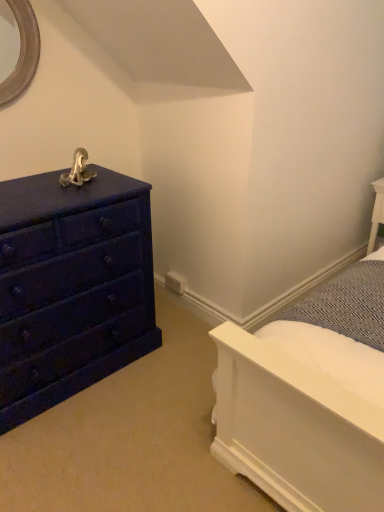
Question: Is white textured fabric at upper right turned away from matte dark blue dresser at left?

Choices:
 (A) no
 (B) yes

Answer: (A)

Question: From a real-world perspective, is white textured fabric at upper right located higher than matte dark blue dresser at left?

Choices:
 (A) no
 (B) yes

Answer: (A)

Question: Could you tell me if white textured fabric at upper right is facing matte dark blue dresser at left?

Choices:
 (A) no
 (B) yes

Answer: (A)

Question: Is white textured fabric at upper right outside matte dark blue dresser at left?

Choices:
 (A) yes
 (B) no

Answer: (A)

Question: From the image's perspective, does white textured fabric at upper right appear higher than matte dark blue dresser at left?

Choices:
 (A) yes
 (B) no

Answer: (B)

Question: Is white textured fabric at upper right positioned in front of matte dark blue dresser at left?

Choices:
 (A) yes
 (B) no

Answer: (B)

Question: Is matte dark blue dresser at left at the left side of white textured fabric at upper right?

Choices:
 (A) no
 (B) yes

Answer: (B)

Question: From a real-world perspective, is matte dark blue dresser at left beneath white textured fabric at upper right?

Choices:
 (A) no
 (B) yes

Answer: (A)

Question: Is matte dark blue dresser at left taller than white textured fabric at upper right?

Choices:
 (A) yes
 (B) no

Answer: (A)

Question: Considering the relative sizes of matte dark blue dresser at left and white textured fabric at upper right in the image provided, is matte dark blue dresser at left bigger than white textured fabric at upper right?

Choices:
 (A) no
 (B) yes

Answer: (B)

Question: Is matte dark blue dresser at left thinner than white textured fabric at upper right?

Choices:
 (A) yes
 (B) no

Answer: (B)

Question: Does matte dark blue dresser at left have a lesser height compared to white textured fabric at upper right?

Choices:
 (A) yes
 (B) no

Answer: (B)

Question: Would you say matte dark blue dresser at left is to the left or to the right of white textured fabric at upper right in the picture?

Choices:
 (A) right
 (B) left

Answer: (B)